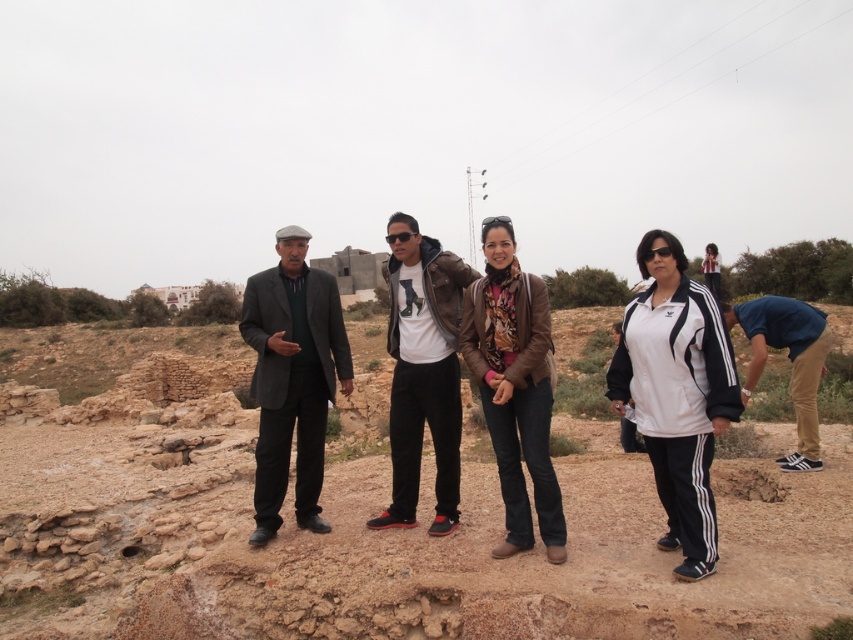
Question: Which point appears farthest from the camera in this image?

Choices:
 (A) (x=296, y=486)
 (B) (x=410, y=369)
 (C) (x=637, y=586)

Answer: (B)

Question: From the image, what is the correct spatial relationship of brown leather jacket at center in relation to blue fabric shirt at lower right?

Choices:
 (A) left
 (B) right

Answer: (A)

Question: Which object appears farthest from the camera in this image?

Choices:
 (A) matte leather jacket at center
 (B) dark gray woolen suit at center
 (C) blue fabric shirt at lower right
 (D) brown dirt field at center

Answer: (A)

Question: Does dark gray woolen suit at center have a lesser width compared to blue fabric shirt at lower right?

Choices:
 (A) no
 (B) yes

Answer: (A)

Question: Which object is positioned farthest from the matte leather jacket at center?

Choices:
 (A) blue fabric shirt at lower right
 (B) dark gray woolen suit at center

Answer: (A)

Question: Is matte leather jacket at center to the right of blue fabric shirt at lower right from the viewer's perspective?

Choices:
 (A) no
 (B) yes

Answer: (A)